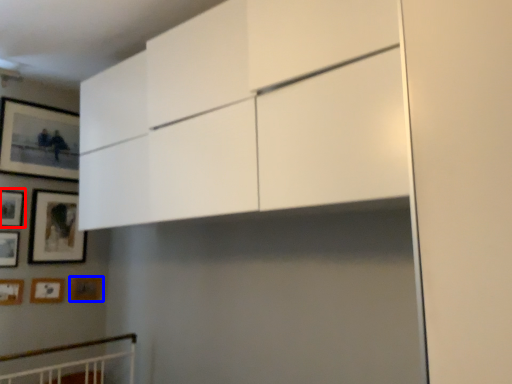
Question: Which object is closer to the camera taking this photo, picture frame (highlighted by a red box) or picture frame (highlighted by a blue box)?

Choices:
 (A) picture frame
 (B) picture frame

Answer: (A)